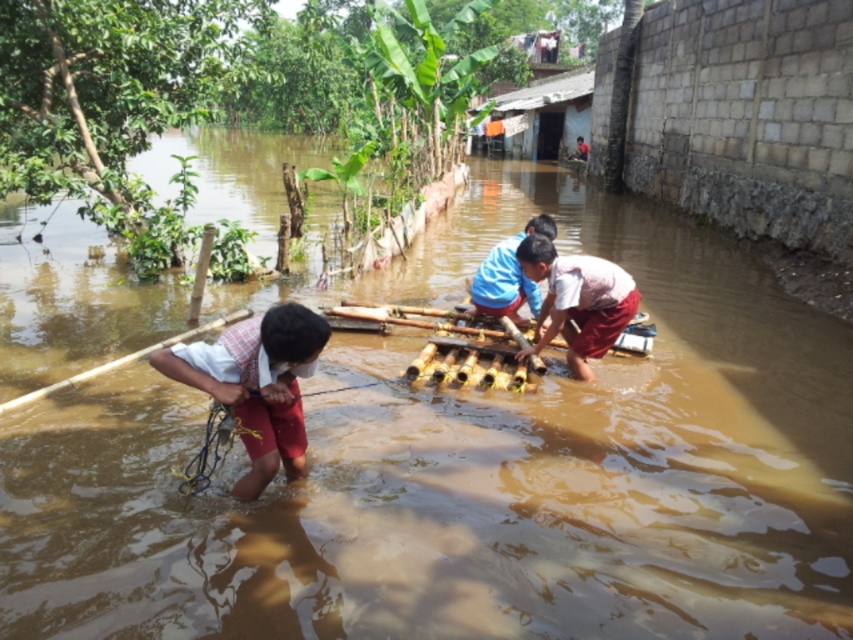
Does white cotton shirt at lower left have a lesser width compared to pink fabric at center?

Yes.

Who is taller, white cotton shirt at lower left or pink fabric at center?

With more height is pink fabric at center.

Who is more forward, (x=259, y=451) or (x=573, y=305)?

Point (x=259, y=451)

This screenshot has height=640, width=853. I want to click on white cotton shirt at lower left, so click(257, 385).